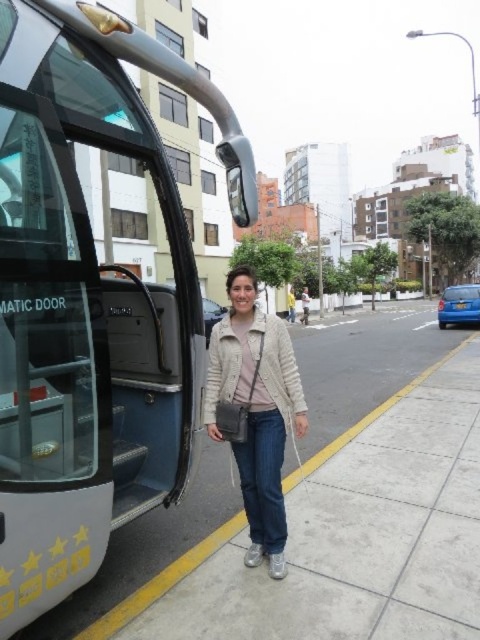
Who is shorter, metallic silver tour bus at center or light beige textured jacket at center?

light beige textured jacket at center is shorter.

Does metallic silver tour bus at center have a lesser width compared to light beige textured jacket at center?

Incorrect, metallic silver tour bus at center's width is not less than light beige textured jacket at center's.

Does point (243, 202) come behind point (275, 378)?

Yes, point (243, 202) is farther from viewer.

At what (x,y) coordinates should I click in order to perform the action: click on metallic silver tour bus at center. Please return your answer as a coordinate pair (x, y). The height and width of the screenshot is (640, 480). Looking at the image, I should click on (88, 301).